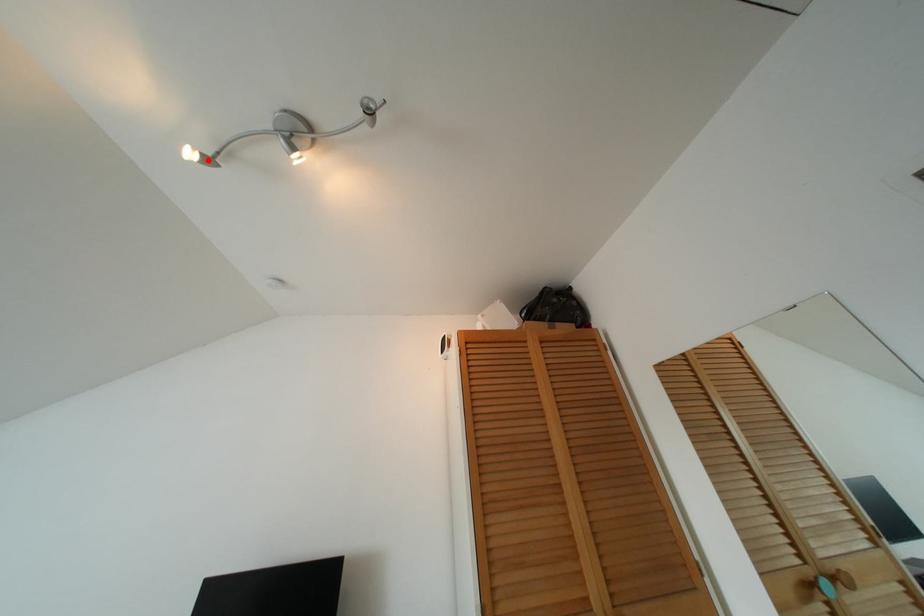
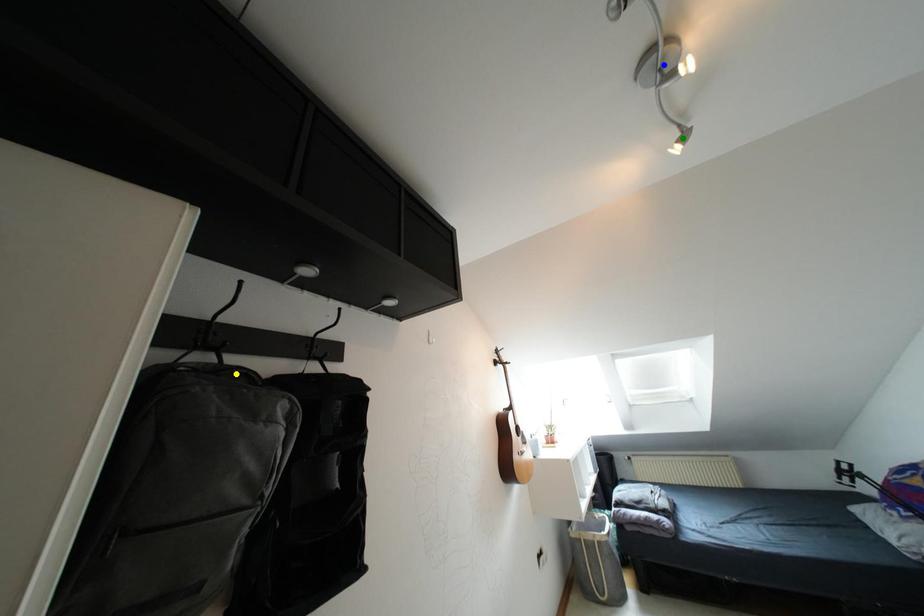
Question: I am providing you with two images of the same scene from different viewpoints. A red point is marked on the first image. You are given multiple points on the second image. In image 2, which mark is for the same physical point as the one in image 1?

Choices:
 (A) yellow point
 (B) blue point
 (C) green point

Answer: (C)